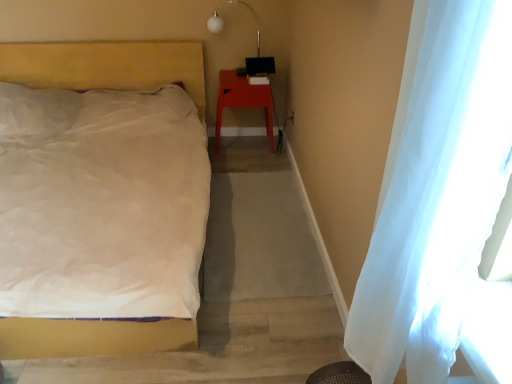
Question: In the image, is white glass lamp at upper center on the left side or the right side of matte plastic stool at right?

Choices:
 (A) left
 (B) right

Answer: (A)

Question: In terms of width, does white glass lamp at upper center look wider or thinner when compared to matte plastic stool at right?

Choices:
 (A) wide
 (B) thin

Answer: (B)

Question: Which object is positioned closest to the white glass lamp at upper center?

Choices:
 (A) matte plastic stool at right
 (B) white sheer curtain at right
 (C) white matte bed at left

Answer: (A)

Question: Based on their relative distances, which object is farther from the white matte bed at left?

Choices:
 (A) white sheer curtain at right
 (B) white glass lamp at upper center
 (C) matte plastic stool at right

Answer: (A)